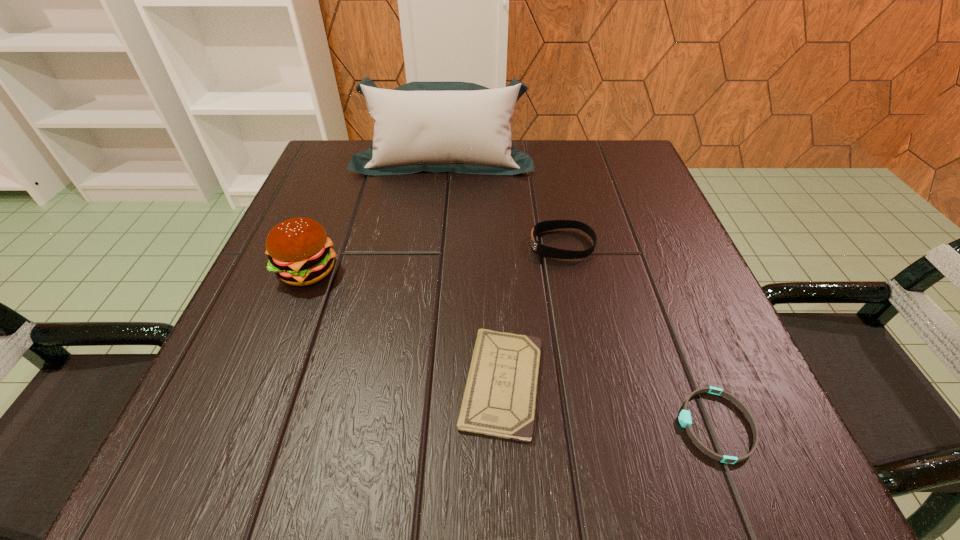
Find the location of a particular element. The width and height of the screenshot is (960, 540). the third closest object to the second tallest object is located at coordinates (550, 252).

Identify which object is the second closest to the tallest object. Please provide its 2D coordinates. Your answer should be formatted as a tuple, i.e. [(x, y)], where the tuple contains the x and y coordinates of a point satisfying the conditions above.

[(299, 250)]

Locate an element on the screen. This screenshot has height=540, width=960. free spot that satisfies the following two spatial constraints: 1. on the surface of the checkbook; 2. on the left side of the farthest object is located at coordinates (418, 383).

Locate an element on the screen. vacant space that satisfies the following two spatial constraints: 1. on the surface of the cushion; 2. on the left side of the checkbook is located at coordinates (418, 383).

Where is `vacant region that satisfies the following two spatial constraints: 1. on the display of the taller wristband; 2. on the front side of the hamburger`? vacant region that satisfies the following two spatial constraints: 1. on the display of the taller wristband; 2. on the front side of the hamburger is located at coordinates (567, 271).

You are a GUI agent. You are given a task and a screenshot of the screen. Output one action in this format:
    pyautogui.click(x=<x>, y=<y>)
    Task: Click on the vacant area that satisfies the following two spatial constraints: 1. on the surface of the cushion; 2. on the right side of the checkbook
    
    Given the screenshot: What is the action you would take?
    tap(418, 383)